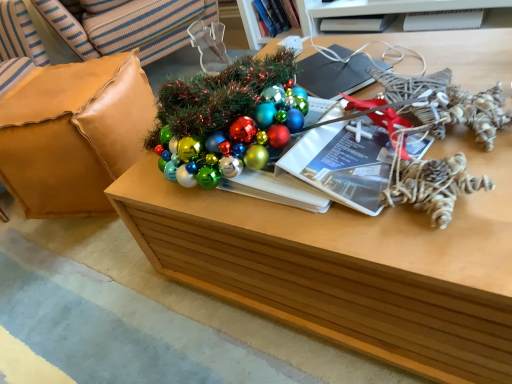
Question: In terms of width, does white matte book at upper center, which appears as the second book when viewed from the left, look wider or thinner when compared to matte paper magazine at center, which is counted as the third magazine, starting from the right?

Choices:
 (A) wide
 (B) thin

Answer: (B)

Question: From a real-world perspective, is white matte book at upper center, acting as the first book starting from the right, above or below matte paper magazine at center, which is the third magazine in top-to-bottom order?

Choices:
 (A) below
 (B) above

Answer: (A)

Question: Based on their relative distances, which object is farther from the twisted rope ornament at right?

Choices:
 (A) black matte magazine at upper center, placed as the second magazine when sorted from bottom to top
 (B) wooden table at center
 (C) white plastic magazine at upper right, the 1th magazine from the right
 (D) matte paper magazine at center, which is counted as the 1th magazine, starting from the front
 (E) white matte book at upper center, acting as the first book starting from the right

Answer: (E)

Question: Which is nearer to the matte paper magazine at center, which ranks as the third magazine in back-to-front order?

Choices:
 (A) white matte book at upper center, which appears as the second book when viewed from the left
 (B) hardcover book at upper center, which is the second book in right-to-left order
 (C) black matte magazine at upper center, the second magazine in the top-to-bottom sequence
 (D) leather cushion at left
 (E) wooden table at center

Answer: (E)